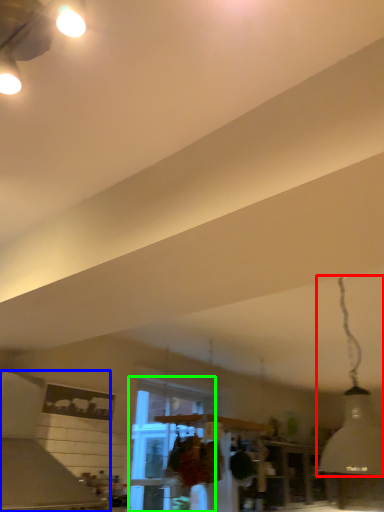
Question: Which object is positioned closest to lamp (highlighted by a red box)? Select from vent (highlighted by a blue box) and window (highlighted by a green box).

Choices:
 (A) vent
 (B) window

Answer: (B)